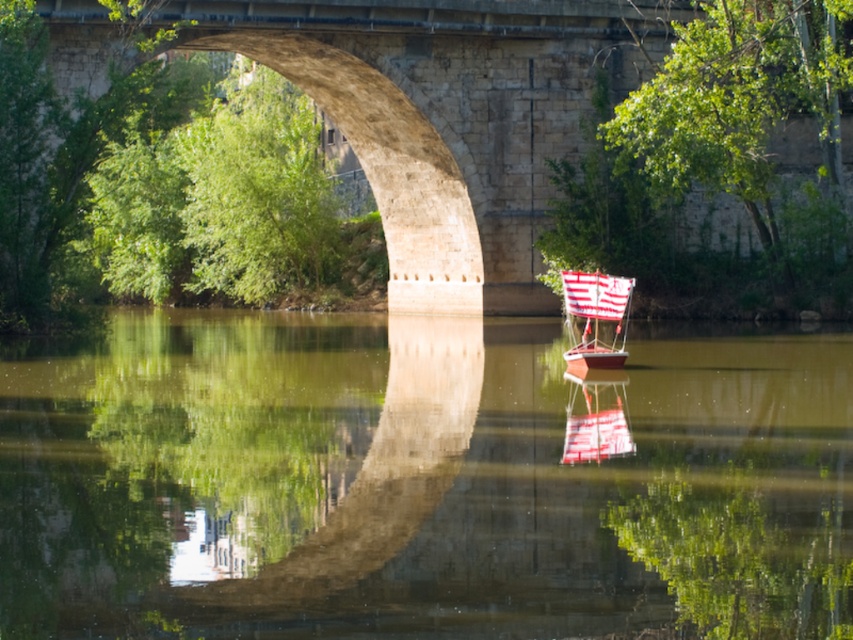
You are standing on the large stone bridge and want to take a photo of the green reflective water at center. Where should you aim your camera to capture it?

You should aim your camera at point [421,481] to capture the green reflective water at center.

You are an observer standing on the riverside. You see the stone bridge at center and the white fabric sailboat at center. Which object is closer to you?

The stone bridge at center is closer to you because the white fabric sailboat at center is behind it.

You are an architect analyzing the riverside scene. You need to determine which object occupies a larger area in the image between the green reflective water at center and the stone bridge at center. Based on the scene description, which one is bigger?

The stone bridge at center is larger than the green reflective water at center.